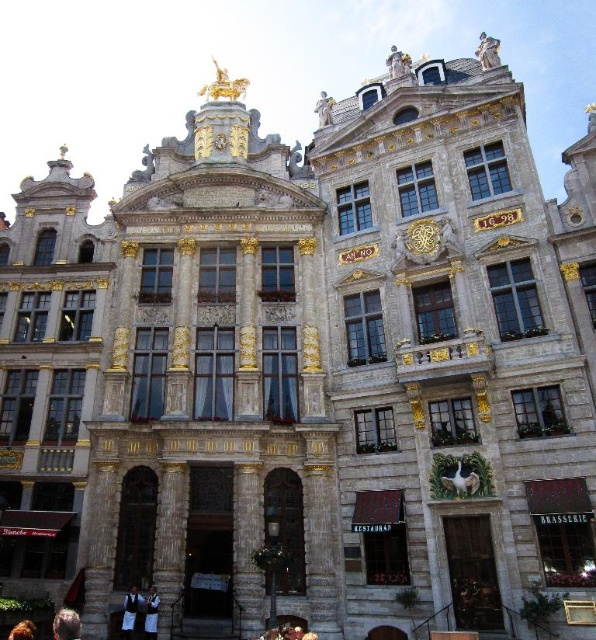
You are standing at the camera position in front of the grand ornate building. You notice a brown leather jacket at lower left. If you want to pick it up, how many steps do you need to take to reach it?

The brown leather jacket at lower left is 129.34 feet away. Assuming an average step length of about 2.5 feet, you would need approximately 52 steps to reach it.

You are standing in front of the grand ornate building and want to determine the spatial relationship between two points marked on the facade. Which point, point 1 at coordinates (157, 600) or point 2 at (14, 625), is closer to you?

Point 1 at coordinates (157, 600) is closer to the viewer than point 2 at (14, 625).